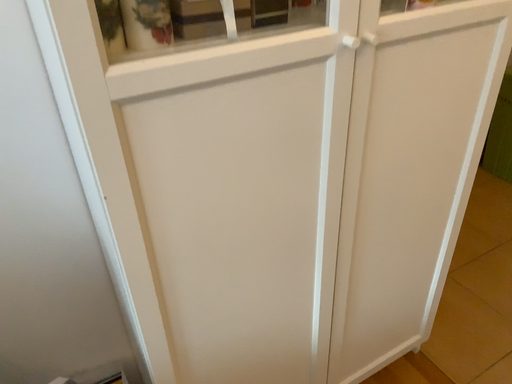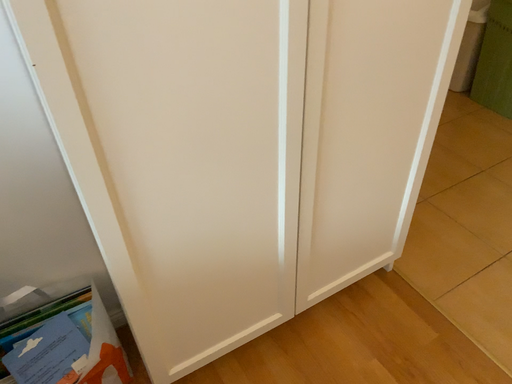
Question: How did the camera likely rotate when shooting the video?

Choices:
 (A) rotated upward
 (B) rotated downward

Answer: (B)